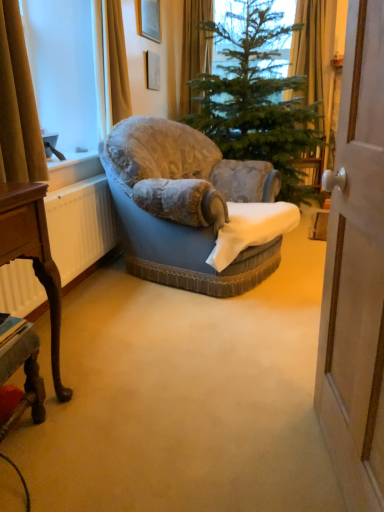
At what (x,y) coordinates should I click in order to perform the action: click on free spot below white matte radiator at left (from a real-world perspective). Please return your answer as a coordinate pair (x, y). Looking at the image, I should click on (74, 295).